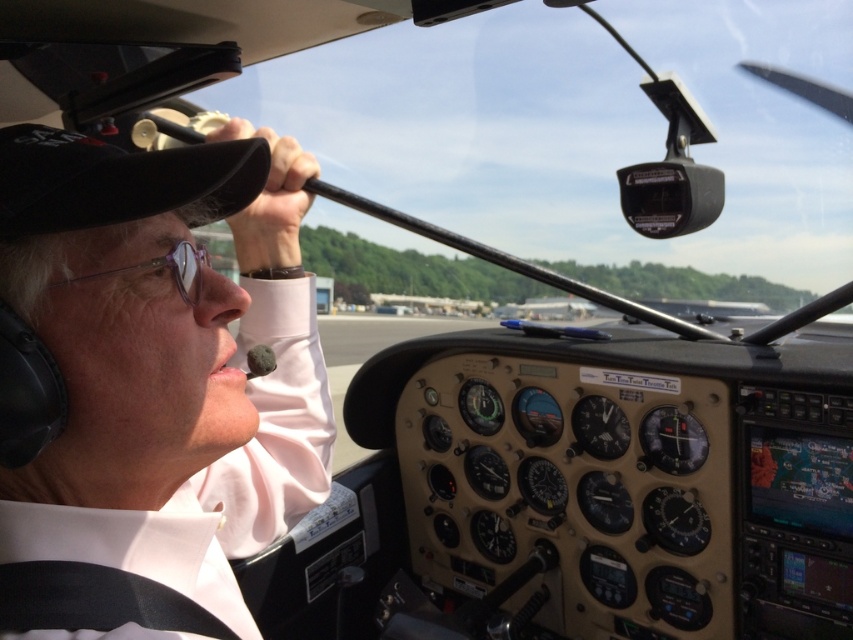
Question: Which point is closer to the camera?

Choices:
 (A) matte black headset at upper left
 (B) clear plastic glasses at upper left

Answer: (A)

Question: Which point is farther to the camera?

Choices:
 (A) (193, 220)
 (B) (55, 285)

Answer: (A)

Question: Is the position of matte black headset at upper left less distant than that of clear plastic glasses at upper left?

Choices:
 (A) yes
 (B) no

Answer: (A)

Question: Can you confirm if matte black headset at upper left is smaller than clear plastic glasses at upper left?

Choices:
 (A) yes
 (B) no

Answer: (B)

Question: Is matte black headset at upper left bigger than clear plastic glasses at upper left?

Choices:
 (A) yes
 (B) no

Answer: (A)